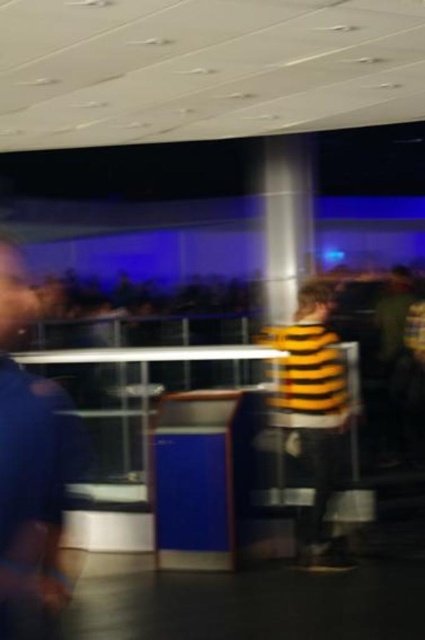
Looking at this image, you are a photographer trying to capture a clear shot of both the blue fabric shirt at left and the yellow striped shirt at center. Since the image is blurry, you decide to adjust your camera settings to focus on the taller subject first. Which shirt should you focus on first?

The yellow striped shirt at center is taller than the blue fabric shirt at left, so you should focus on the yellow striped shirt at center first.

From the picture: You are standing in the scene and want to locate the blue fabric shirt at left. According to the coordinates provided, where should you look in the frame to find it?

The blue fabric shirt at left is located at the 2D coordinates point (30, 470) in the frame.